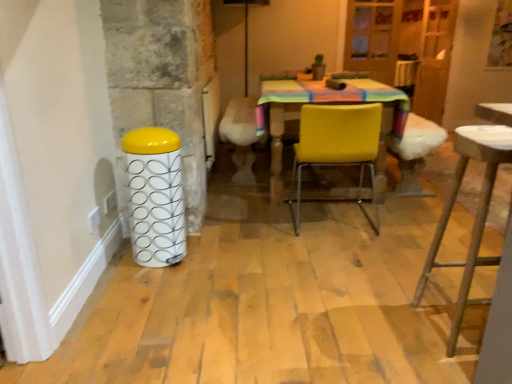
The image size is (512, 384). In order to click on vacant space in front of yellow matte chair at center in this screenshot , I will do `click(350, 257)`.